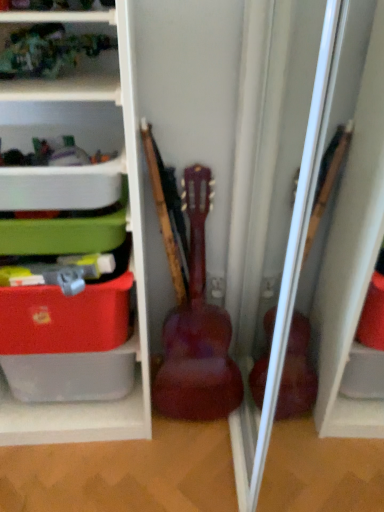
The image size is (384, 512). I want to click on unoccupied area in front of glossy wood guitar at center, so click(200, 455).